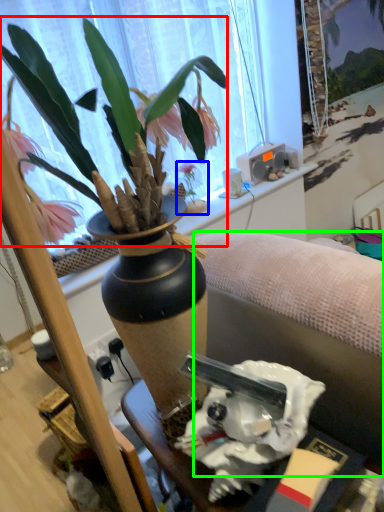
Question: Which object is the closest to the flower (highlighted by a red box)? Choose among these: houseplant (highlighted by a blue box) or studio couch (highlighted by a green box).

Choices:
 (A) houseplant
 (B) studio couch

Answer: (B)